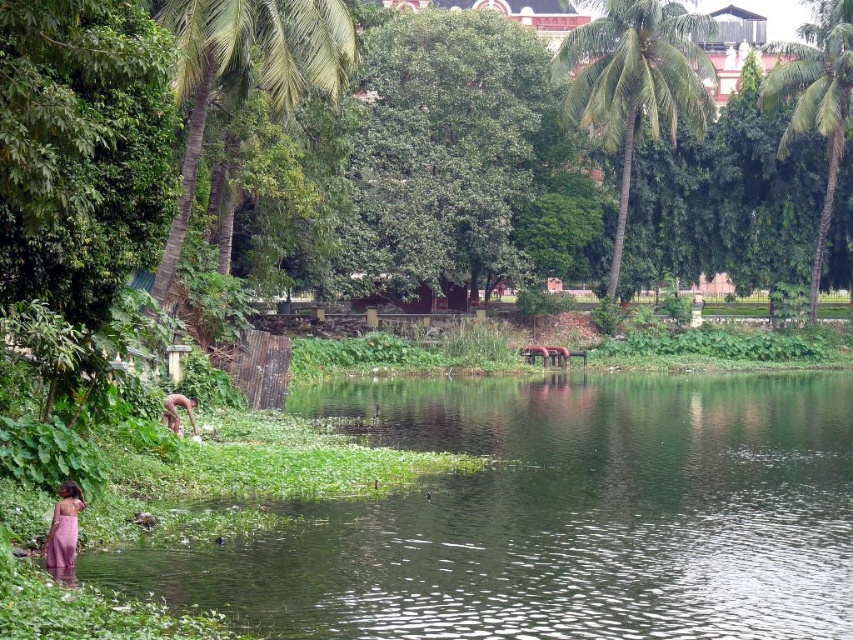
Can you confirm if green leafy river at lower left is positioned above brown fabric person at lower left?

Incorrect, green leafy river at lower left is not positioned above brown fabric person at lower left.

Which is more to the left, green leafy river at lower left or brown fabric person at lower left?

brown fabric person at lower left is more to the left.

Who is more distant from viewer, (671, 544) or (164, 397)?

Point (164, 397)

Where is `green leafy river at lower left`? This screenshot has height=640, width=853. green leafy river at lower left is located at coordinates (556, 516).

Does green leafy palm tree at upper left appear over pink fabric dress at lower left?

Yes.

Is green leafy palm tree at upper left shorter than pink fabric dress at lower left?

No, green leafy palm tree at upper left is not shorter than pink fabric dress at lower left.

Which is in front, point (186, 205) or point (48, 531)?

Positioned in front is point (48, 531).

Where is `green leafy palm tree at upper left`? green leafy palm tree at upper left is located at coordinates (248, 72).

Which is in front, point (802, 97) or point (181, 396)?

Point (181, 396) is in front.

Who is shorter, green leafy palm tree at upper right or brown fabric person at lower left?

With less height is brown fabric person at lower left.

Is point (822, 0) in front of point (189, 406)?

No, (822, 0) is behind (189, 406).

Find the location of `green leafy palm tree at upper right`. green leafy palm tree at upper right is located at coordinates (816, 100).